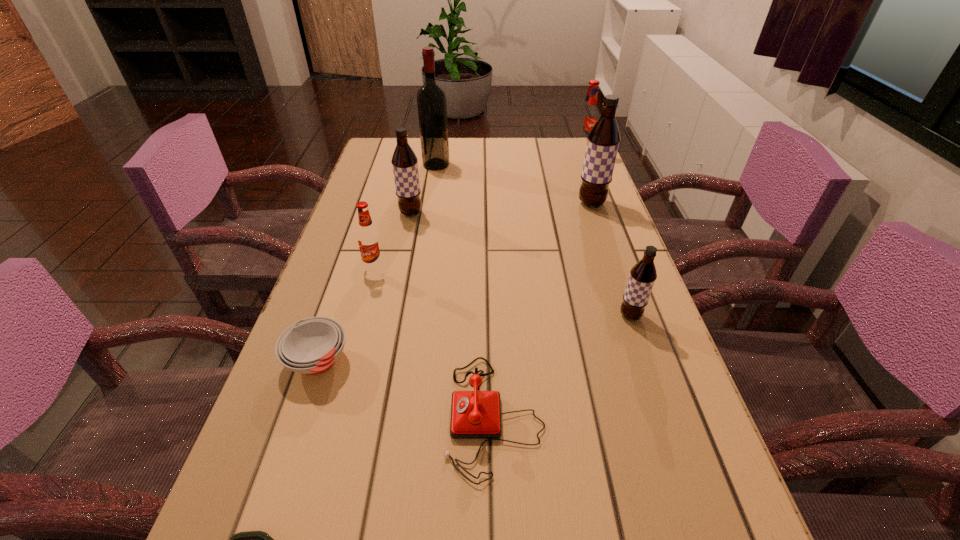
Where is `red telephone`? red telephone is located at coordinates (475, 414).

Find the location of a particular element. Image resolution: width=960 pixels, height=540 pixels. telephone is located at coordinates click(x=475, y=414).

This screenshot has height=540, width=960. I want to click on soup bowl, so click(x=311, y=346).

The image size is (960, 540). What are the coordinates of `vacant space located on the front and back of the green alcohol` in the screenshot? It's located at (481, 165).

Identify the location of vacant area situated on the left of the tallest root beer. (514, 204).

I want to click on vacant area located 0.100m on the left of the farthest root beer, so click(542, 155).

This screenshot has width=960, height=540. Identify the location of vacant space situated on the back of the second biggest brown root beer. (416, 191).

I want to click on free point located 0.150m on the back of the fifth farthest object, so point(387,226).

Locate an element on the screen. Image resolution: width=960 pixels, height=540 pixels. free space located 0.230m on the back of the smallest brown root beer is located at coordinates (605, 242).

Identify the location of vacant space located on the dial of the red telephone. (341, 416).